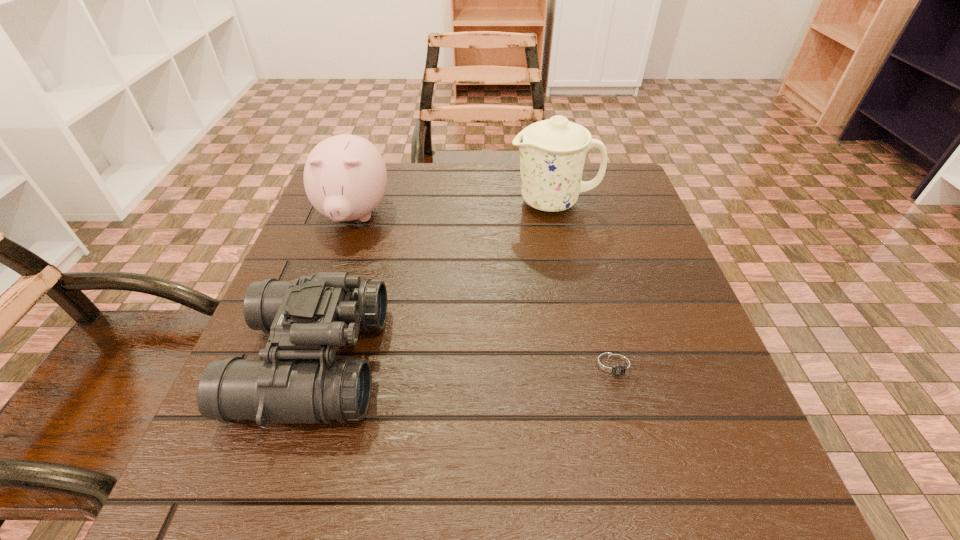
Locate an element on the screen. Image resolution: width=960 pixels, height=540 pixels. chinaware that is at the far edge is located at coordinates 552,152.

Locate an element on the screen. piggy bank that is at the far edge is located at coordinates (345, 177).

Locate an element on the screen. This screenshot has height=540, width=960. piggy bank located in the left edge section of the desktop is located at coordinates [345, 177].

What are the coordinates of `binoculars that is at the left edge` in the screenshot? It's located at (298, 379).

Locate an element on the screen. chinaware that is at the right edge is located at coordinates (552, 152).

You are a GUI agent. You are given a task and a screenshot of the screen. Output one action in this format:
    pyautogui.click(x=<x>, y=<y>)
    Task: Click on the watch that is positioned at the right edge
    The image size is (960, 540).
    Given the screenshot: What is the action you would take?
    pyautogui.click(x=615, y=366)

The height and width of the screenshot is (540, 960). What are the coordinates of `object that is at the far left corner` in the screenshot? It's located at (345, 177).

This screenshot has height=540, width=960. What are the coordinates of `object situated at the far right corner` in the screenshot? It's located at (x=552, y=152).

This screenshot has height=540, width=960. Identify the location of vacant space at the far edge. (442, 185).

In the image, there is a desktop. Where is `vacant space at the near edge`? This screenshot has height=540, width=960. vacant space at the near edge is located at coordinates (421, 470).